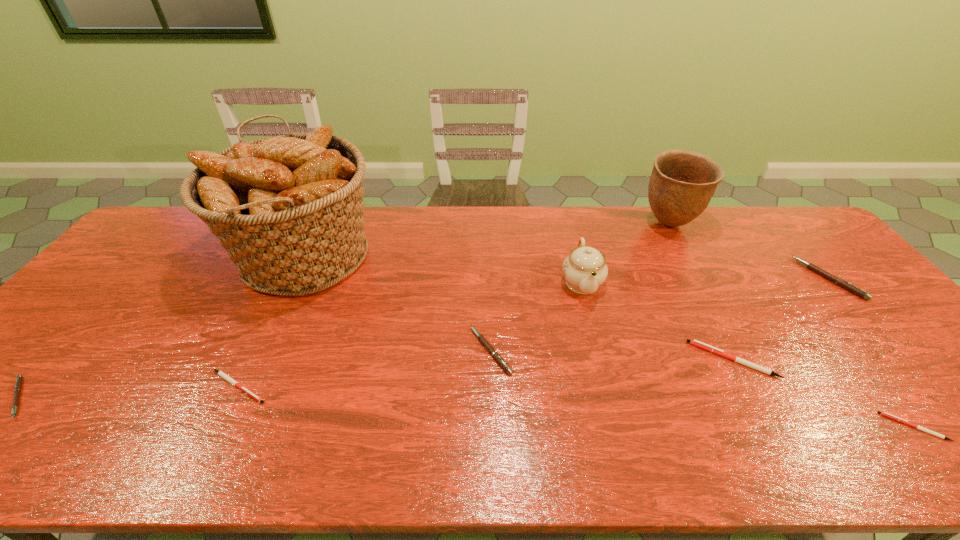
This screenshot has width=960, height=540. I want to click on basket located at the far edge, so click(288, 209).

This screenshot has width=960, height=540. What are the coordinates of `pottery that is at the far edge` in the screenshot? It's located at (682, 183).

The image size is (960, 540). I want to click on object at the near edge, so click(885, 414).

Identify the location of object that is at the near right corner. Image resolution: width=960 pixels, height=540 pixels. (885, 414).

At what (x,y) coordinates should I click in order to perform the action: click on free space at the far edge. Please return your answer as a coordinate pair (x, y). This screenshot has width=960, height=540. Looking at the image, I should click on (616, 209).

In the image, there is a desktop. Where is `vacant space at the near edge`? The height and width of the screenshot is (540, 960). vacant space at the near edge is located at coordinates (835, 435).

Where is `vacant space at the left edge`? The height and width of the screenshot is (540, 960). vacant space at the left edge is located at coordinates (151, 264).

Image resolution: width=960 pixels, height=540 pixels. I want to click on free space at the right edge of the desktop, so click(x=820, y=303).

Where is `vacant point at the far right corner`? The height and width of the screenshot is (540, 960). vacant point at the far right corner is located at coordinates (778, 222).

Image resolution: width=960 pixels, height=540 pixels. Identify the location of vacant space at the near right corner of the desktop. (941, 428).